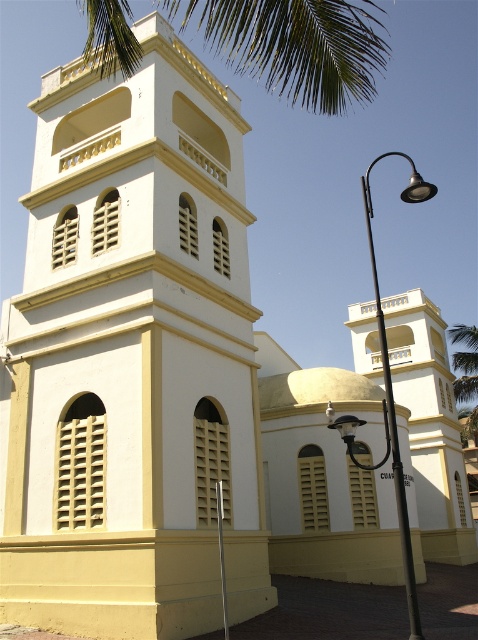
Which is more to the left, green leafy palm at upper center or green leafy palm tree at upper right?

green leafy palm at upper center

Can you confirm if green leafy palm at upper center is shorter than green leafy palm tree at upper right?

No.

Who is more forward, (x=127, y=56) or (x=467, y=333)?

Positioned in front is point (x=127, y=56).

Locate an element on the screen. The height and width of the screenshot is (640, 478). green leafy palm at upper center is located at coordinates (295, 45).

Locate an element on the screen. white matte tower at center is located at coordinates (431, 426).

Where is `white matte tower at center`? Image resolution: width=478 pixels, height=640 pixels. white matte tower at center is located at coordinates (431, 426).

Where is `white matte tower at center`? The height and width of the screenshot is (640, 478). white matte tower at center is located at coordinates (431, 426).

Is black metal streetlight at center closer to camera compared to green leafy palm tree at upper right?

Yes, it is.

Is black metal streetlight at center thinner than green leafy palm tree at upper right?

No, black metal streetlight at center is not thinner than green leafy palm tree at upper right.

You are a GUI agent. You are given a task and a screenshot of the screen. Output one action in this format:
    pyautogui.click(x=<x>, y=<y>)
    Task: Click on the black metal streetlight at center
    This screenshot has width=478, height=640.
    Given the screenshot: What is the action you would take?
    pyautogui.click(x=391, y=387)